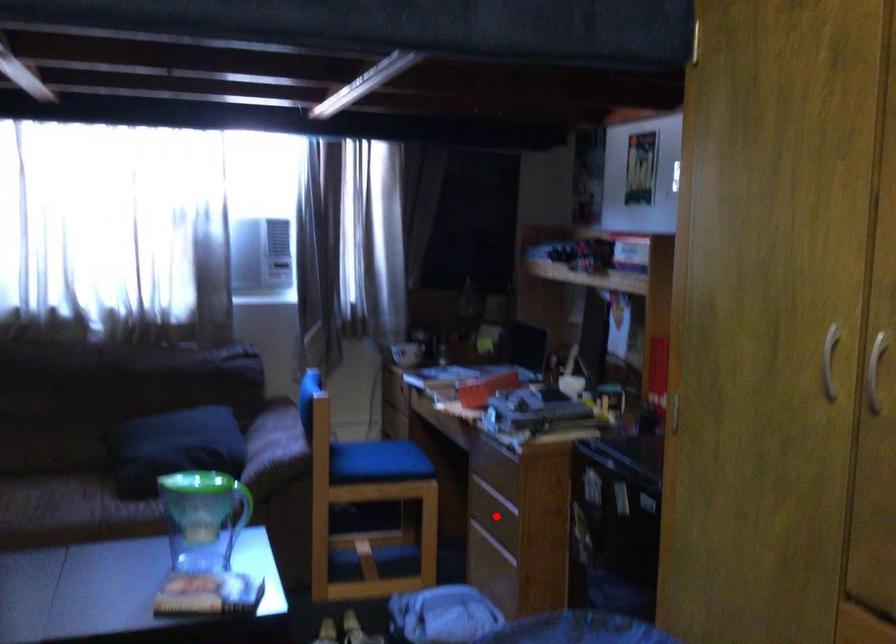
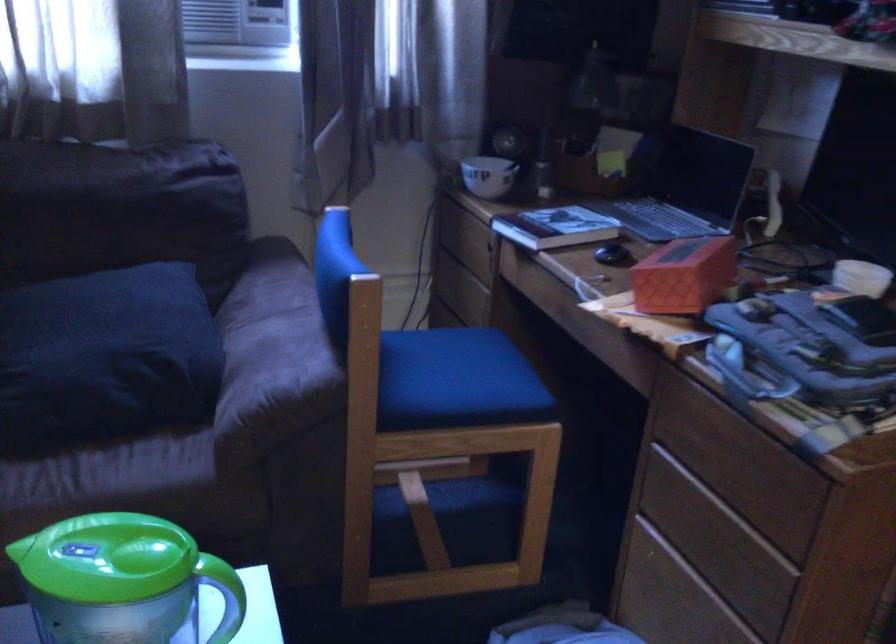
In the second image, find the point that corresponds to the highlighted location in the first image.

(716, 541)